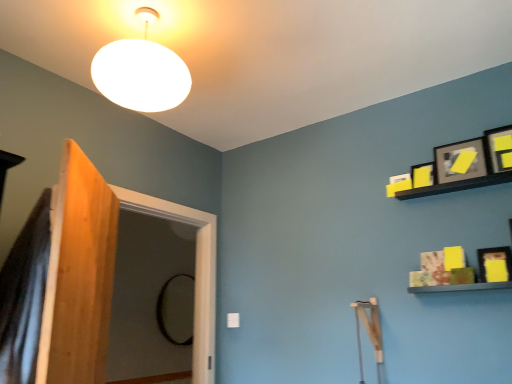
At what (x,y) coordinates should I click in order to perform the action: click on matte black picture frame at upper right, which is counted as the 1th picture frame, starting from the top. Please return your answer as a coordinate pair (x, y). Image resolution: width=512 pixels, height=384 pixels. Looking at the image, I should click on (499, 148).

I want to click on wooden screen door at left, so click(196, 270).

Is black glass mirror at center positioned with its back to matte black picture frame at upper right, which is counted as the 1th picture frame, starting from the top?

No, black glass mirror at center is not facing away from matte black picture frame at upper right, which is counted as the 1th picture frame, starting from the top.

Would you say black glass mirror at center is outside matte black picture frame at upper right, placed as the 4th picture frame when sorted from bottom to top?

That's correct, black glass mirror at center is outside of matte black picture frame at upper right, placed as the 4th picture frame when sorted from bottom to top.

Is point (180, 345) positioned after point (504, 145)?

Yes, it is behind point (504, 145).

How much distance is there between wooden screen door at left and black glass mirror at center?

wooden screen door at left is 2.31 meters from black glass mirror at center.

Does point (183, 210) appear closer or farther from the camera than point (182, 273)?

Clearly, point (183, 210) is closer to the camera than point (182, 273).

Considering the relative sizes of wooden screen door at left and black glass mirror at center in the image provided, is wooden screen door at left wider than black glass mirror at center?

Indeed, wooden screen door at left has a greater width compared to black glass mirror at center.

Looking at this image, how many degrees apart are the facing directions of wooden screen door at left and black glass mirror at center?

The angle between the facing direction of wooden screen door at left and the facing direction of black glass mirror at center is 0.00114 degrees.

From a real-world perspective, between matte black picture frame at upper right, the third picture frame in the bottom-to-top sequence, and matte black picture frame at upper right, which is counted as the 1th picture frame, starting from the top, who is vertically higher?

matte black picture frame at upper right, which is counted as the 1th picture frame, starting from the top, is physically above.

Can you see matte black picture frame at upper right, which appears as the 2th picture frame when viewed from the top, touching matte black picture frame at upper right, which is counted as the 1th picture frame, starting from the top?

No, matte black picture frame at upper right, which appears as the 2th picture frame when viewed from the top, is not making contact with matte black picture frame at upper right, which is counted as the 1th picture frame, starting from the top.

Which of these two, matte black picture frame at upper right, which appears as the 2th picture frame when viewed from the top, or matte black picture frame at upper right, placed as the 4th picture frame when sorted from bottom to top, is bigger?

matte black picture frame at upper right, which appears as the 2th picture frame when viewed from the top, is bigger.

Which is closer to the camera, (472,144) or (503,154)?

Point (472,144).

Considering the positions of point (421, 182) and point (158, 84), is point (421, 182) closer or farther from the camera than point (158, 84)?

Point (421, 182).

Is yellow matte picture frame at upper right, which ranks as the 2th picture frame in bottom-to-top order, positioned far away from white matte lampshade at upper center?

That's right, there is a large distance between yellow matte picture frame at upper right, which ranks as the 2th picture frame in bottom-to-top order, and white matte lampshade at upper center.

Does yellow matte picture frame at upper right, positioned as the third picture frame in top-to-bottom order, have a larger size compared to white matte lampshade at upper center?

No.

From the image's perspective, is yellow matte picture frame at upper right, which ranks as the 2th picture frame in bottom-to-top order, above or below white matte lampshade at upper center?

yellow matte picture frame at upper right, which ranks as the 2th picture frame in bottom-to-top order, is situated lower than white matte lampshade at upper center in the image.

In the scene shown: Which is less distant, (483, 273) or (199, 262)?

Point (483, 273)

You are a GUI agent. You are given a task and a screenshot of the screen. Output one action in this format:
    pyautogui.click(x=<x>, y=<y>)
    Task: Click on the screen door that is on the left side of matte black picture frame at upper right, positioned as the 4th picture frame in top-to-bottom order
    
    Given the screenshot: What is the action you would take?
    pyautogui.click(x=196, y=270)

Looking at the image, does matte black picture frame at upper right, the 1th picture frame when ordered from bottom to top, seem bigger or smaller compared to wooden screen door at left?

Clearly, matte black picture frame at upper right, the 1th picture frame when ordered from bottom to top, is smaller in size than wooden screen door at left.

Is matte black picture frame at upper right, the 1th picture frame when ordered from bottom to top, in front of or behind wooden screen door at left in the image?

In the image, matte black picture frame at upper right, the 1th picture frame when ordered from bottom to top, appears in front of wooden screen door at left.

From a real-world perspective, who is located higher, yellow matte picture frame at upper right, which ranks as the 2th picture frame in bottom-to-top order, or black glass mirror at center?

yellow matte picture frame at upper right, which ranks as the 2th picture frame in bottom-to-top order, from a real-world perspective.

Based on the photo, from the image's perspective, is yellow matte picture frame at upper right, positioned as the third picture frame in top-to-bottom order, positioned above or below black glass mirror at center?

Clearly, from the image's perspective, yellow matte picture frame at upper right, positioned as the third picture frame in top-to-bottom order, is above black glass mirror at center.

Is yellow matte picture frame at upper right, positioned as the third picture frame in top-to-bottom order, wider or thinner than black glass mirror at center?

yellow matte picture frame at upper right, positioned as the third picture frame in top-to-bottom order, is thinner than black glass mirror at center.

Would you say yellow matte picture frame at upper right, positioned as the third picture frame in top-to-bottom order, contains black glass mirror at center?

Definitely not — black glass mirror at center is not inside yellow matte picture frame at upper right, positioned as the third picture frame in top-to-bottom order.

Is matte black picture frame at upper right, the third picture frame in the bottom-to-top sequence, positioned far away from black glass mirror at center?

Indeed, matte black picture frame at upper right, the third picture frame in the bottom-to-top sequence, is not near black glass mirror at center.

From a real-world perspective, which object stands above the other?

In real-world perspective, matte black picture frame at upper right, which appears as the 2th picture frame when viewed from the top, is above.

Is point (451, 156) closer or farther from the camera than point (165, 284)?

Point (451, 156).

Starting from the black glass mirror at center, which picture frame is the 2nd one to the right? Please provide its 2D coordinates.

[(460, 161)]

From the image's perspective, which picture frame is the 4th one above the black glass mirror at center? Please provide its 2D coordinates.

[(499, 148)]

Where is `mirror behind the wooden screen door at left`? The height and width of the screenshot is (384, 512). mirror behind the wooden screen door at left is located at coordinates (162, 315).

Estimate the real-world distances between objects in this image. Which object is closer to yellow matte picture frame at upper right, which ranks as the 2th picture frame in bottom-to-top order, white matte lampshade at upper center or matte black picture frame at upper right, the third picture frame in the bottom-to-top sequence?

matte black picture frame at upper right, the third picture frame in the bottom-to-top sequence.

From the image, which object appears to be nearer to black glass mirror at center, matte black picture frame at upper right, which appears as the 2th picture frame when viewed from the top, or matte black picture frame at upper right, placed as the 4th picture frame when sorted from bottom to top?

Based on the image, matte black picture frame at upper right, which appears as the 2th picture frame when viewed from the top, appears to be nearer to black glass mirror at center.

Based on the photo, considering their positions, is matte black picture frame at upper right, which appears as the 2th picture frame when viewed from the top, positioned closer to yellow matte picture frame at upper right, positioned as the third picture frame in top-to-bottom order, than matte black picture frame at upper right, placed as the 4th picture frame when sorted from bottom to top?

matte black picture frame at upper right, which appears as the 2th picture frame when viewed from the top, is positioned closer to the anchor yellow matte picture frame at upper right, positioned as the third picture frame in top-to-bottom order.

From the image, which object appears to be nearer to yellow matte picture frame at upper right, positioned as the third picture frame in top-to-bottom order, matte black picture frame at upper right, placed as the 4th picture frame when sorted from bottom to top, or black glass mirror at center?

The object closer to yellow matte picture frame at upper right, positioned as the third picture frame in top-to-bottom order, is matte black picture frame at upper right, placed as the 4th picture frame when sorted from bottom to top.

In the scene shown: Estimate the real-world distances between objects in this image. Which object is further from wooden screen door at left, matte black picture frame at upper right, placed as the 4th picture frame when sorted from bottom to top, or white matte lampshade at upper center?

matte black picture frame at upper right, placed as the 4th picture frame when sorted from bottom to top, is further to wooden screen door at left.

Which object lies further to the anchor point matte black picture frame at upper right, which appears as the 2th picture frame when viewed from the top, white matte lampshade at upper center or yellow matte picture frame at upper right, positioned as the third picture frame in top-to-bottom order?

white matte lampshade at upper center lies further to matte black picture frame at upper right, which appears as the 2th picture frame when viewed from the top, than the other object.

Considering their positions, is matte black picture frame at upper right, placed as the 4th picture frame when sorted from bottom to top, positioned closer to matte black picture frame at upper right, the 1th picture frame when ordered from bottom to top, than wooden screen door at left?

matte black picture frame at upper right, placed as the 4th picture frame when sorted from bottom to top, is closer to matte black picture frame at upper right, the 1th picture frame when ordered from bottom to top.

Estimate the real-world distances between objects in this image. Which object is further from yellow matte picture frame at upper right, which ranks as the 2th picture frame in bottom-to-top order, matte black picture frame at upper right, the 1th picture frame when ordered from bottom to top, or white matte lampshade at upper center?

white matte lampshade at upper center is positioned further to the anchor yellow matte picture frame at upper right, which ranks as the 2th picture frame in bottom-to-top order.

Image resolution: width=512 pixels, height=384 pixels. Find the location of `screen door between matte black picture frame at upper right, placed as the 4th picture frame when sorted from bottom to top, and black glass mirror at center, along the z-axis`. screen door between matte black picture frame at upper right, placed as the 4th picture frame when sorted from bottom to top, and black glass mirror at center, along the z-axis is located at coordinates (196, 270).

At what (x,y) coordinates should I click in order to perform the action: click on lamp between wooden screen door at left and matte black picture frame at upper right, the third picture frame in the bottom-to-top sequence, from left to right. Please return your answer as a coordinate pair (x, y). The height and width of the screenshot is (384, 512). Looking at the image, I should click on (141, 71).

Where is `picture frame between white matte lampshade at upper center and matte black picture frame at upper right, which appears as the 2th picture frame when viewed from the top`? Image resolution: width=512 pixels, height=384 pixels. picture frame between white matte lampshade at upper center and matte black picture frame at upper right, which appears as the 2th picture frame when viewed from the top is located at coordinates (422, 175).

Locate an element on the screen. screen door between white matte lampshade at upper center and black glass mirror at center along the z-axis is located at coordinates (196, 270).